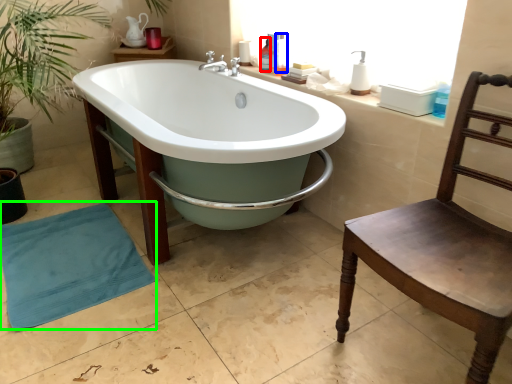
Question: Estimate the real-world distances between objects in this image. Which object is closer to toiletry (highlighted by a red box), toiletry (highlighted by a blue box) or beach towel (highlighted by a green box)?

Choices:
 (A) toiletry
 (B) beach towel

Answer: (A)